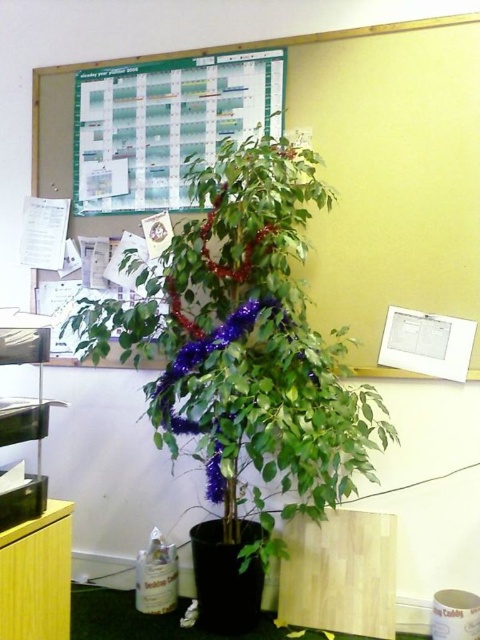
Question: Can you confirm if green matte bulletin board at upper center is bigger than green paper at upper center?

Choices:
 (A) yes
 (B) no

Answer: (A)

Question: Among these objects, which one is nearest to the camera?

Choices:
 (A) green paper at upper center
 (B) green glossy plant at center
 (C) yellow wood cabinet at lower left

Answer: (C)

Question: Is green glossy plant at center positioned before yellow wood cabinet at lower left?

Choices:
 (A) yes
 (B) no

Answer: (B)

Question: Which point is closer to the camera taking this photo?

Choices:
 (A) (34, 538)
 (B) (101, 74)

Answer: (A)

Question: Among these points, which one is nearest to the camera?

Choices:
 (A) (x=233, y=102)
 (B) (x=225, y=93)
 (C) (x=25, y=573)

Answer: (C)

Question: Is green matte bulletin board at upper center further to the viewer compared to green paper at upper center?

Choices:
 (A) yes
 (B) no

Answer: (A)